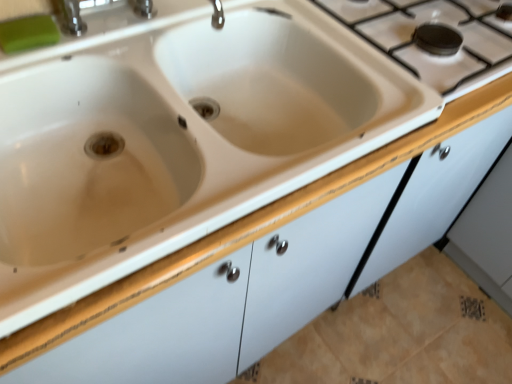
Question: Can you confirm if white ceramic gas stove at upper right is wider than white ceramic sink at center?

Choices:
 (A) no
 (B) yes

Answer: (A)

Question: Does white ceramic gas stove at upper right have a lesser height compared to white ceramic sink at center?

Choices:
 (A) yes
 (B) no

Answer: (A)

Question: Would you say white ceramic gas stove at upper right contains white ceramic sink at center?

Choices:
 (A) no
 (B) yes

Answer: (A)

Question: Is white ceramic gas stove at upper right directly adjacent to white ceramic sink at center?

Choices:
 (A) no
 (B) yes

Answer: (A)

Question: Does white ceramic gas stove at upper right have a lesser width compared to white ceramic sink at center?

Choices:
 (A) yes
 (B) no

Answer: (A)

Question: Would you consider white ceramic gas stove at upper right to be distant from white ceramic sink at center?

Choices:
 (A) no
 (B) yes

Answer: (A)

Question: Can you confirm if white ceramic sink at center is positioned to the right of green rubber soap at upper left?

Choices:
 (A) no
 (B) yes

Answer: (B)

Question: Considering the relative positions of white ceramic sink at center and green rubber soap at upper left in the image provided, is white ceramic sink at center in front of green rubber soap at upper left?

Choices:
 (A) no
 (B) yes

Answer: (B)

Question: From the image's perspective, would you say white ceramic sink at center is shown under green rubber soap at upper left?

Choices:
 (A) no
 (B) yes

Answer: (B)

Question: Does white ceramic sink at center turn towards green rubber soap at upper left?

Choices:
 (A) yes
 (B) no

Answer: (B)

Question: Is white ceramic sink at center to the left of green rubber soap at upper left from the viewer's perspective?

Choices:
 (A) no
 (B) yes

Answer: (A)

Question: From a real-world perspective, is white ceramic sink at center beneath green rubber soap at upper left?

Choices:
 (A) no
 (B) yes

Answer: (B)

Question: Can you confirm if white ceramic sink at center is shorter than white ceramic gas stove at upper right?

Choices:
 (A) no
 (B) yes

Answer: (A)